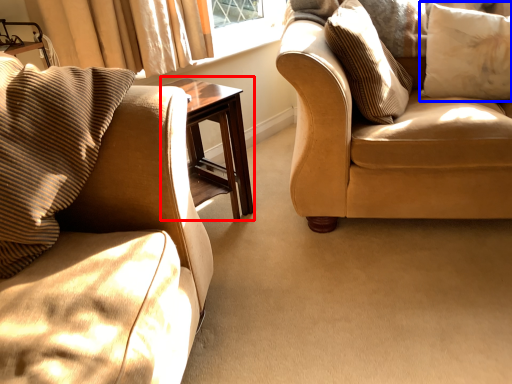
Question: Which of the following is the farthest to the observer, table (highlighted by a red box) or pillow (highlighted by a blue box)?

Choices:
 (A) table
 (B) pillow

Answer: (B)